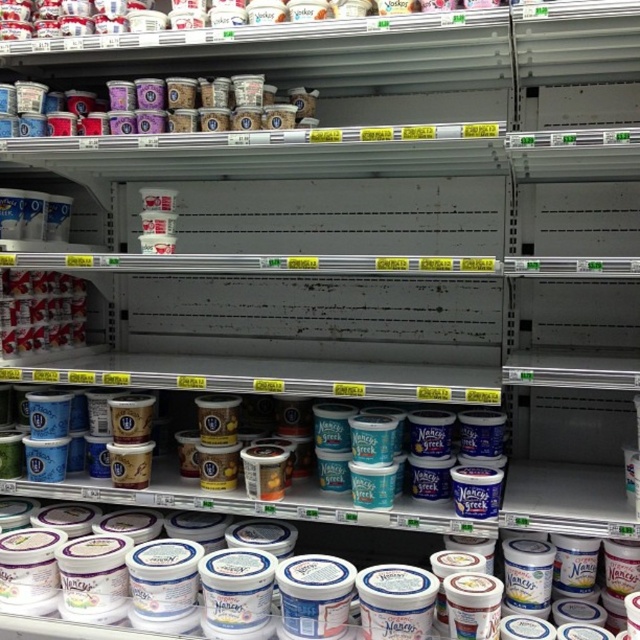
Does point (13, 100) lie in front of point (83, 339)?

Yes, it is in front of point (83, 339).

Is matte plastic yogurt cups at upper center bigger than metallic silver yogurt at left?

Yes, matte plastic yogurt cups at upper center is bigger than metallic silver yogurt at left.

Find the location of a particular element. The width and height of the screenshot is (640, 640). matte plastic yogurt cups at upper center is located at coordinates (156, 108).